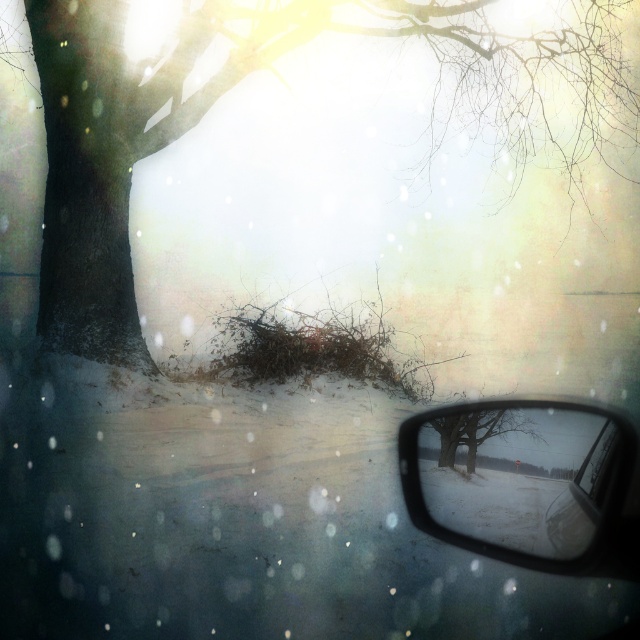
This screenshot has width=640, height=640. What do you see at coordinates (280, 77) in the screenshot?
I see `brown textured tree at upper left` at bounding box center [280, 77].

Does brown textured tree at upper left come in front of clear plastic side mirror at lower right?

No, brown textured tree at upper left is further to the viewer.

Where is `brown textured tree at upper left`? This screenshot has width=640, height=640. brown textured tree at upper left is located at coordinates coord(280,77).

I want to click on brown textured tree at upper left, so click(x=280, y=77).